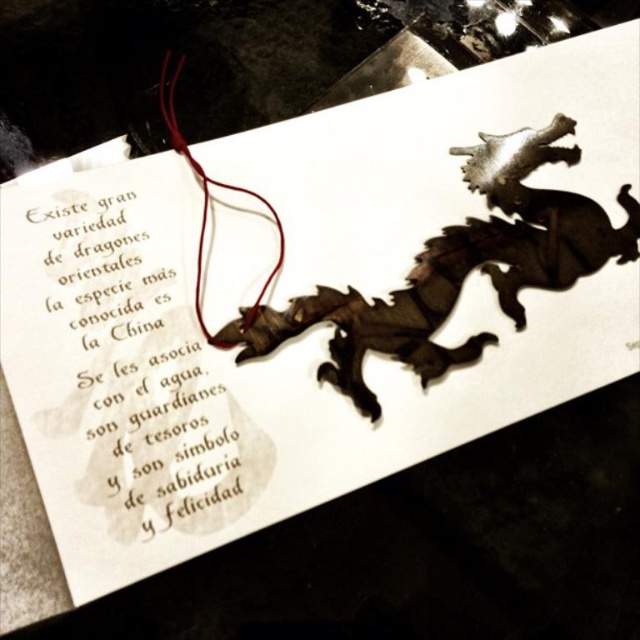
Question: Among these points, which one is nearest to the camera?

Choices:
 (A) (426, 365)
 (B) (81, 432)

Answer: (B)

Question: Does gold calligraphy text at upper left appear under red leather string at upper left?

Choices:
 (A) yes
 (B) no

Answer: (A)

Question: Is gold calligraphy text at upper left further to camera compared to metallic silver dragon at center?

Choices:
 (A) yes
 (B) no

Answer: (B)

Question: Which object appears closest to the camera in this image?

Choices:
 (A) red leather string at upper left
 (B) gold calligraphy text at upper left
 (C) metallic silver dragon at center

Answer: (B)

Question: Which point is farther to the camera?

Choices:
 (A) (116, 496)
 (B) (170, 115)
 (C) (486, 157)

Answer: (C)

Question: Is gold calligraphy text at upper left in front of metallic silver dragon at center?

Choices:
 (A) no
 (B) yes

Answer: (B)